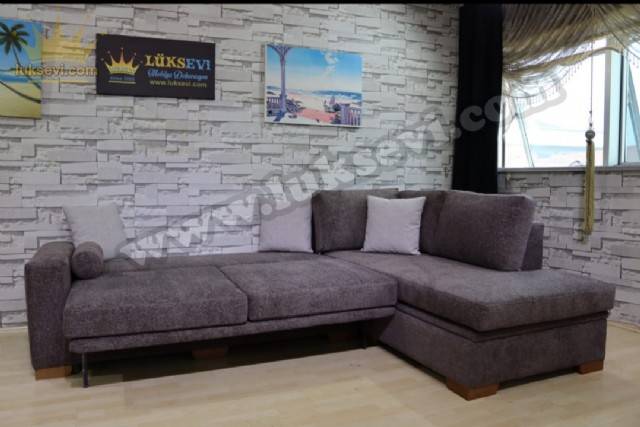
At what (x,y) coordinates should I click in order to perform the action: click on couch. Please return your answer as a coordinate pair (x, y). Looking at the image, I should click on (387, 294).